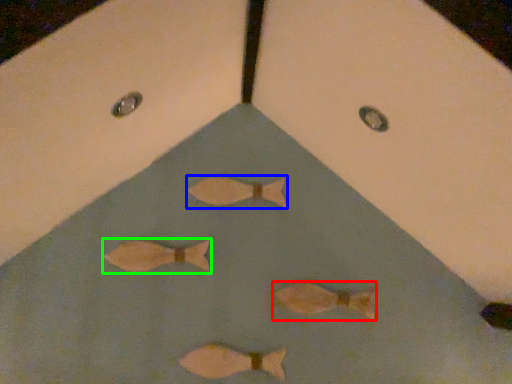
Question: Estimate the real-world distances between objects in this image. Which object is farther from fish (highlighted by a red box), fish (highlighted by a blue box) or fish (highlighted by a green box)?

Choices:
 (A) fish
 (B) fish

Answer: (B)